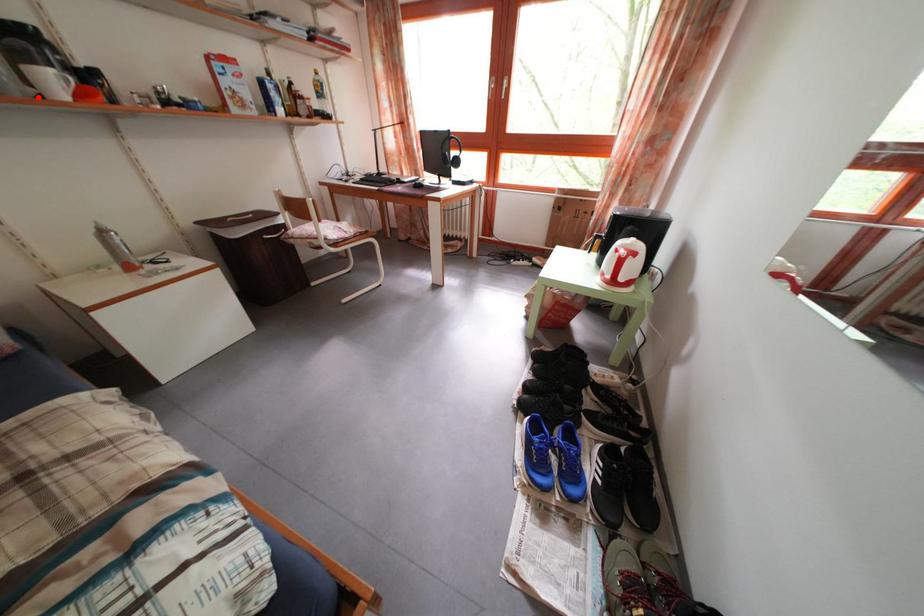
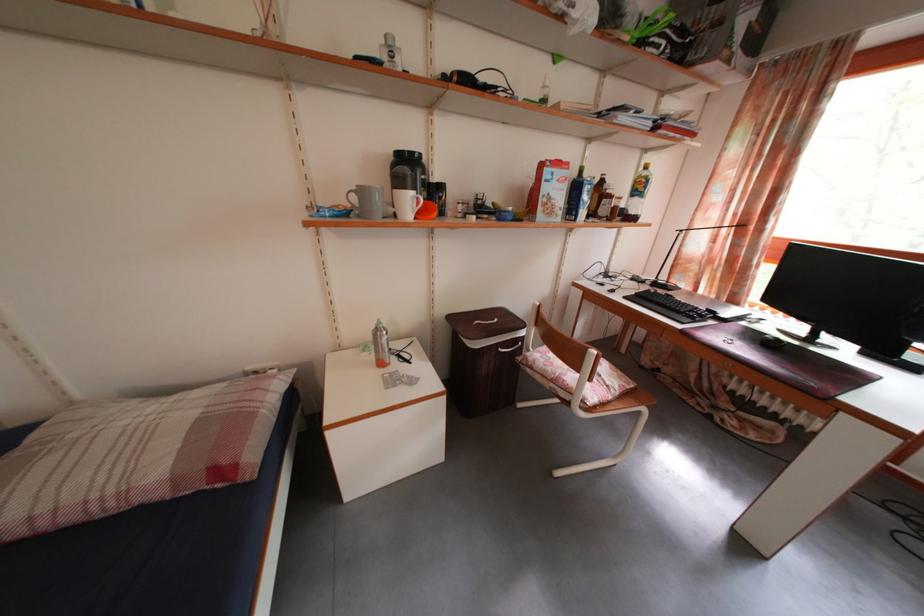
Question: I am providing you with two images of the same scene from different viewpoints. A red point is shown in image1. For the corresponding object point in image2, is it positioned nearer or farther from the camera?

Choices:
 (A) Nearer
 (B) Farther

Answer: (A)